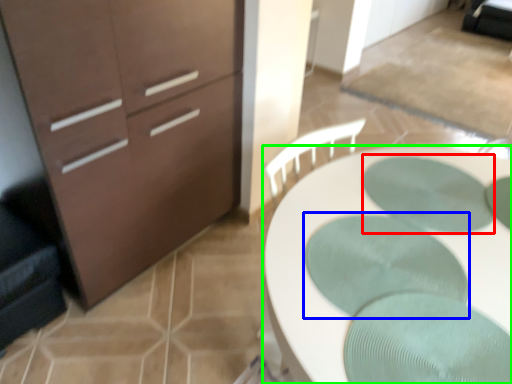
Question: Which object is the farthest from oval (highlighted by a red box)? Choose among these: oval (highlighted by a blue box) or desk (highlighted by a green box).

Choices:
 (A) oval
 (B) desk

Answer: (A)